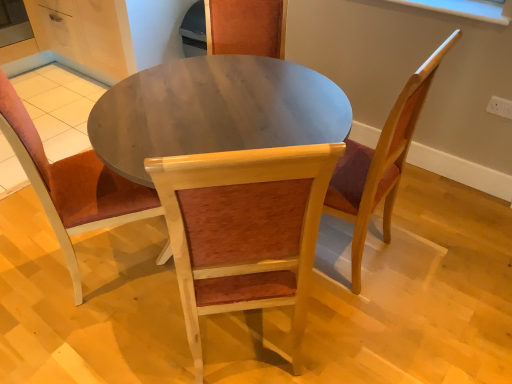
Question: Considering the relative sizes of wooden chair with cushion at center, which is counted as the first chair, starting from the right, and wooden chair at center, the third chair in the right-to-left sequence, in the image provided, is wooden chair with cushion at center, which is counted as the first chair, starting from the right, shorter than wooden chair at center, the third chair in the right-to-left sequence,?

Choices:
 (A) no
 (B) yes

Answer: (A)

Question: Does wooden chair with cushion at center, acting as the third chair starting from the left, have a greater height compared to wooden chair at center, the third chair in the right-to-left sequence?

Choices:
 (A) yes
 (B) no

Answer: (A)

Question: Is the depth of wooden chair with cushion at center, acting as the third chair starting from the left, less than that of wooden chair at center, marked as the first chair in a left-to-right arrangement?

Choices:
 (A) yes
 (B) no

Answer: (B)

Question: Is wooden chair with cushion at center, which is counted as the first chair, starting from the right, facing away from wooden chair at center, marked as the first chair in a left-to-right arrangement?

Choices:
 (A) no
 (B) yes

Answer: (A)

Question: From a real-world perspective, is wooden chair with cushion at center, which is counted as the first chair, starting from the right, on top of wooden chair at center, marked as the first chair in a left-to-right arrangement?

Choices:
 (A) no
 (B) yes

Answer: (B)

Question: Based on their sizes in the image, would you say wooden chair at center, the third chair in the right-to-left sequence, is bigger or smaller than wooden chair with cushion at center, which is counted as the first chair, starting from the right?

Choices:
 (A) big
 (B) small

Answer: (B)

Question: Considering the positions of point (78, 231) and point (354, 205), is point (78, 231) closer or farther from the camera than point (354, 205)?

Choices:
 (A) farther
 (B) closer

Answer: (A)

Question: Is wooden chair at center, the third chair in the right-to-left sequence, inside the boundaries of wooden chair with cushion at center, which is counted as the first chair, starting from the right, or outside?

Choices:
 (A) outside
 (B) inside

Answer: (A)

Question: Would you say wooden chair at center, the third chair in the right-to-left sequence, is to the left or to the right of wooden chair with cushion at center, which is counted as the first chair, starting from the right, in the picture?

Choices:
 (A) left
 (B) right

Answer: (A)

Question: Considering the positions of point coord(217,170) and point coord(77,286), is point coord(217,170) closer or farther from the camera than point coord(77,286)?

Choices:
 (A) farther
 (B) closer

Answer: (B)

Question: Is wooden chair at center, the 2th chair in the right-to-left sequence, bigger or smaller than wooden chair at center, the third chair in the right-to-left sequence?

Choices:
 (A) big
 (B) small

Answer: (A)

Question: From the image's perspective, relative to wooden chair at center, the third chair in the right-to-left sequence, is wooden chair at center, which appears as the 2th chair when viewed from the left, above or below?

Choices:
 (A) below
 (B) above

Answer: (A)

Question: From a real-world perspective, is wooden chair at center, which appears as the 2th chair when viewed from the left, positioned above or below wooden chair at center, marked as the first chair in a left-to-right arrangement?

Choices:
 (A) above
 (B) below

Answer: (A)

Question: Visually, is wooden chair at center, the third chair in the right-to-left sequence, positioned to the left or to the right of wooden chair at center, the 2th chair in the right-to-left sequence?

Choices:
 (A) left
 (B) right

Answer: (A)

Question: In terms of height, does wooden chair at center, the third chair in the right-to-left sequence, look taller or shorter compared to wooden chair at center, the 2th chair in the right-to-left sequence?

Choices:
 (A) short
 (B) tall

Answer: (A)